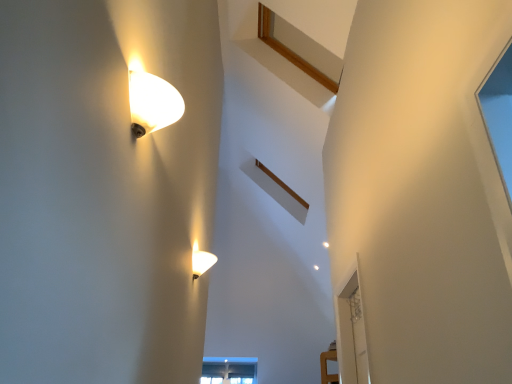
What do you see at coordinates (201, 261) in the screenshot? I see `matte white lamp at lower center, acting as the first lamp starting from the bottom` at bounding box center [201, 261].

You are a GUI agent. You are given a task and a screenshot of the screen. Output one action in this format:
    pyautogui.click(x=<x>, y=<y>)
    Task: Click on the transparent glass door at right
    Image resolution: width=512 pixels, height=384 pixels.
    Given the screenshot: What is the action you would take?
    pyautogui.click(x=351, y=330)

What's the angular difference between matte white lamp at lower center, placed as the 1th lamp when sorted from back to front, and transparent glass door at right's facing directions?

There is a 180-degree angle between the facing directions of matte white lamp at lower center, placed as the 1th lamp when sorted from back to front, and transparent glass door at right.

Is matte white lamp at lower center, placed as the 1th lamp when sorted from back to front, looking in the opposite direction of transparent glass door at right?

That's not correct — matte white lamp at lower center, placed as the 1th lamp when sorted from back to front, is not looking away from transparent glass door at right.

From the image's perspective, is matte white lamp at lower center, acting as the first lamp starting from the bottom, located beneath transparent glass door at right?

No, from the image's perspective, matte white lamp at lower center, acting as the first lamp starting from the bottom, is not below transparent glass door at right.

Which is less distant, (x=194, y=248) or (x=368, y=356)?

Point (x=194, y=248).

The width and height of the screenshot is (512, 384). In order to click on glass door beneath the matte glass lamp at upper left, which is the 1th lamp in front-to-back order (from a real-world perspective) in this screenshot , I will do `click(351, 330)`.

Is matte glass lamp at upper left, the second lamp positioned from the back, positioned before transparent glass door at right?

Yes, it is in front of transparent glass door at right.

Which is more to the right, matte glass lamp at upper left, which is the 1th lamp in front-to-back order, or transparent glass door at right?

transparent glass door at right is more to the right.

From the image's perspective, which is above, matte glass lamp at upper left, which is the 1th lamp in front-to-back order, or transparent glass door at right?

matte glass lamp at upper left, which is the 1th lamp in front-to-back order, is shown above in the image.

Considering the sizes of objects matte white lamp at lower center, placed as the 1th lamp when sorted from back to front, and matte glass lamp at upper left, which ranks as the second lamp in bottom-to-top order, in the image provided, who is bigger, matte white lamp at lower center, placed as the 1th lamp when sorted from back to front, or matte glass lamp at upper left, which ranks as the second lamp in bottom-to-top order,?

matte glass lamp at upper left, which ranks as the second lamp in bottom-to-top order, is bigger.

Is matte white lamp at lower center, which is counted as the 2th lamp, starting from the top, inside or outside of matte glass lamp at upper left, which is the 1th lamp in front-to-back order?

matte white lamp at lower center, which is counted as the 2th lamp, starting from the top, exists outside the volume of matte glass lamp at upper left, which is the 1th lamp in front-to-back order.

Considering the positions of objects matte white lamp at lower center, placed as the 1th lamp when sorted from back to front, and matte glass lamp at upper left, which is the 1th lamp in front-to-back order, in the image provided, who is behind, matte white lamp at lower center, placed as the 1th lamp when sorted from back to front, or matte glass lamp at upper left, which is the 1th lamp in front-to-back order,?

matte white lamp at lower center, placed as the 1th lamp when sorted from back to front.

Could you tell me if matte white lamp at lower center, the second lamp from the front, is facing matte glass lamp at upper left, which is the 1th lamp in front-to-back order?

No.

Where is `the 2nd lamp above the transparent glass door at right (from a real-world perspective)`? The width and height of the screenshot is (512, 384). the 2nd lamp above the transparent glass door at right (from a real-world perspective) is located at coordinates (201, 261).

Could you tell me if transparent glass door at right is turned towards matte white lamp at lower center, acting as the first lamp starting from the bottom?

Yes, transparent glass door at right is aimed at matte white lamp at lower center, acting as the first lamp starting from the bottom.

From a real-world perspective, is transparent glass door at right positioned above or below matte white lamp at lower center, placed as the 1th lamp when sorted from back to front?

In terms of real-world spatial position, transparent glass door at right is below matte white lamp at lower center, placed as the 1th lamp when sorted from back to front.

Can we say transparent glass door at right lies outside matte white lamp at lower center, acting as the first lamp starting from the bottom?

Yes, transparent glass door at right is not within matte white lamp at lower center, acting as the first lamp starting from the bottom.

Is point (346, 279) positioned behind point (140, 105)?

Yes.

Is transparent glass door at right positioned with its back to matte glass lamp at upper left, which is the 1th lamp in front-to-back order?

That's not correct — transparent glass door at right is not looking away from matte glass lamp at upper left, which is the 1th lamp in front-to-back order.

From the image's perspective, between transparent glass door at right and matte glass lamp at upper left, which is the 1th lamp in front-to-back order, which one is located above?

From the image's view, matte glass lamp at upper left, which is the 1th lamp in front-to-back order, is above.

Locate an element on the screen. Image resolution: width=512 pixels, height=384 pixels. glass door on the right of matte glass lamp at upper left, which is the 1th lamp in front-to-back order is located at coordinates (351, 330).

Locate an element on the screen. This screenshot has height=384, width=512. lamp on the left of the matte glass lamp at upper left, marked as the 1th lamp in a top-to-bottom arrangement is located at coordinates (201, 261).

From a real-world perspective, between matte glass lamp at upper left, the second lamp positioned from the back, and matte white lamp at lower center, the second lamp from the front, who is vertically lower?

From a 3D spatial view, matte glass lamp at upper left, the second lamp positioned from the back, is below.

Who is taller, matte glass lamp at upper left, marked as the 1th lamp in a top-to-bottom arrangement, or matte white lamp at lower center, which is counted as the 2th lamp, starting from the top?

With more height is matte glass lamp at upper left, marked as the 1th lamp in a top-to-bottom arrangement.

In the scene shown: Considering the relative sizes of matte glass lamp at upper left, which ranks as the second lamp in bottom-to-top order, and matte white lamp at lower center, which is counted as the 2th lamp, starting from the top, in the image provided, is matte glass lamp at upper left, which ranks as the second lamp in bottom-to-top order, wider than matte white lamp at lower center, which is counted as the 2th lamp, starting from the top,?

Yes.

Find the location of a particular element. Image resolution: width=512 pixels, height=384 pixels. the 1st lamp above the transparent glass door at right (from the image's perspective) is located at coordinates (201, 261).

You are a GUI agent. You are given a task and a screenshot of the screen. Output one action in this format:
    pyautogui.click(x=<x>, y=<y>)
    Task: Click on the glass door behind the matte glass lamp at upper left, which ranks as the second lamp in bottom-to-top order
    
    Given the screenshot: What is the action you would take?
    pyautogui.click(x=351, y=330)

Based on their spatial positions, is matte glass lamp at upper left, the second lamp positioned from the back, or matte white lamp at lower center, which is counted as the 2th lamp, starting from the top, further from transparent glass door at right?

Based on the image, matte glass lamp at upper left, the second lamp positioned from the back, appears to be further to transparent glass door at right.

Based on their spatial positions, is matte white lamp at lower center, acting as the first lamp starting from the bottom, or transparent glass door at right closer to matte glass lamp at upper left, which is the 1th lamp in front-to-back order?

matte white lamp at lower center, acting as the first lamp starting from the bottom, lies closer to matte glass lamp at upper left, which is the 1th lamp in front-to-back order, than the other object.

From the image, which object appears to be farther from transparent glass door at right, matte white lamp at lower center, acting as the first lamp starting from the bottom, or matte glass lamp at upper left, which ranks as the second lamp in bottom-to-top order?

matte glass lamp at upper left, which ranks as the second lamp in bottom-to-top order, lies further to transparent glass door at right than the other object.

Based on their spatial positions, is transparent glass door at right or matte white lamp at lower center, which is counted as the 2th lamp, starting from the top, further from matte glass lamp at upper left, which ranks as the second lamp in bottom-to-top order?

transparent glass door at right.

When comparing their distances from matte white lamp at lower center, placed as the 1th lamp when sorted from back to front, does matte glass lamp at upper left, which is the 1th lamp in front-to-back order, or transparent glass door at right seem further?

matte glass lamp at upper left, which is the 1th lamp in front-to-back order, lies further to matte white lamp at lower center, placed as the 1th lamp when sorted from back to front, than the other object.

Estimate the real-world distances between objects in this image. Which object is further from matte white lamp at lower center, the second lamp from the front, transparent glass door at right or matte glass lamp at upper left, which is the 1th lamp in front-to-back order?

Among the two, matte glass lamp at upper left, which is the 1th lamp in front-to-back order, is located further to matte white lamp at lower center, the second lamp from the front.

Identify the location of lamp between matte glass lamp at upper left, marked as the 1th lamp in a top-to-bottom arrangement, and transparent glass door at right from front to back. (201, 261).